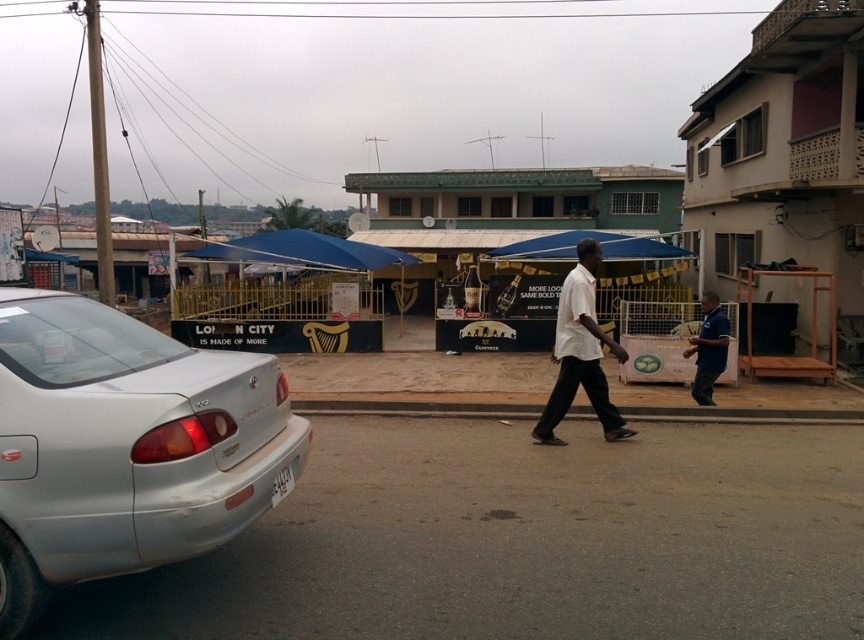
You are a delivery person standing at the camera position. You need to place a package on the silver metallic sedan at left. Can you reach the sedan from your current position without moving? Explain why or why not.

The silver metallic sedan at left and camera are 3.39 meters apart. Since the distance between them is 3.39 meters, you can likely reach the sedan from the camera position without moving, assuming you can stretch or step forward to cover the distance.